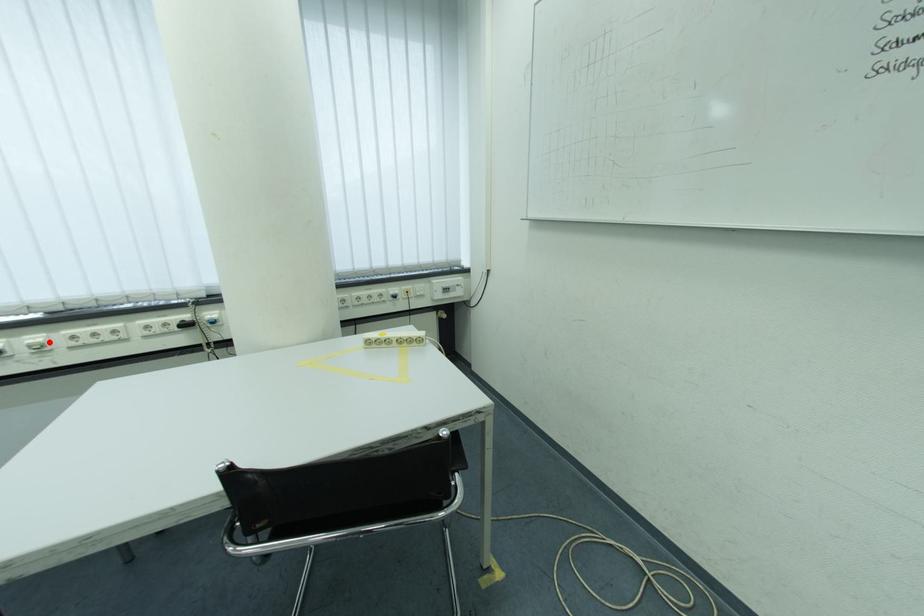
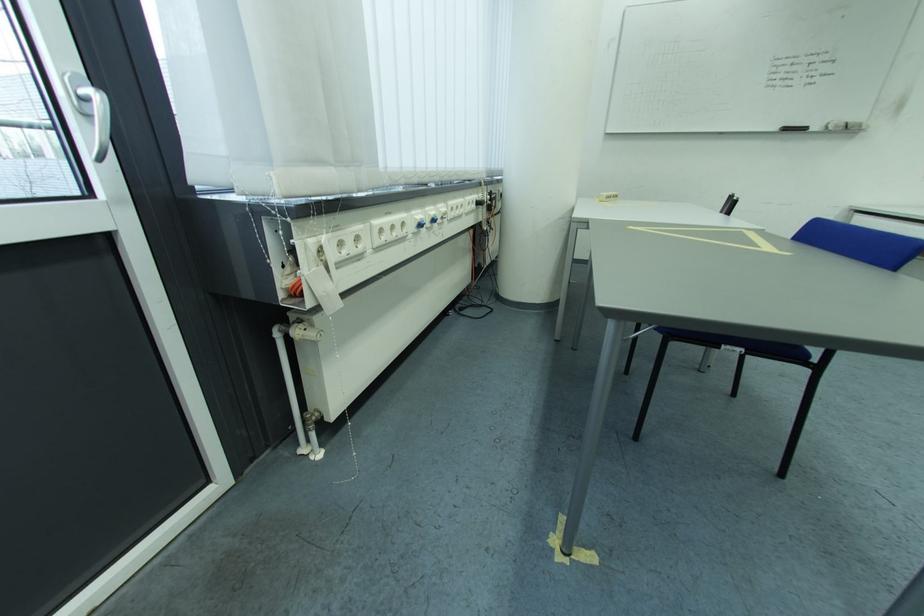
The point at the highlighted location is marked in the first image. Where is the corresponding point in the second image?

(454, 212)